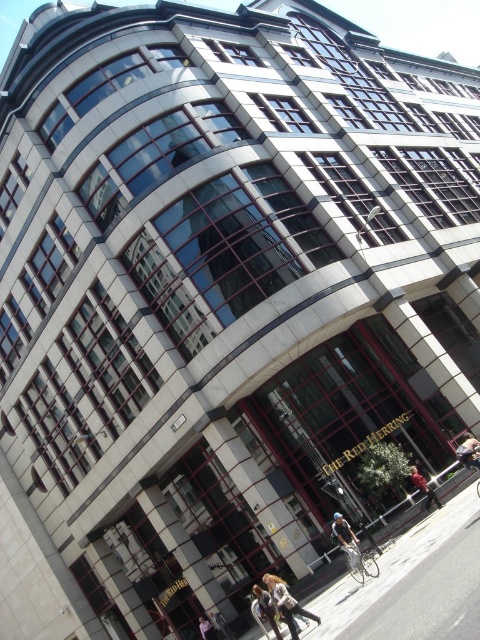
Which is more to the left, leather jacket at lower center or light brown leather jacket at lower center?

light brown leather jacket at lower center is more to the left.

Who is more distant from viewer, (264, 602) or (204, 621)?

Positioned behind is point (204, 621).

Find the location of a particular element. leather jacket at lower center is located at coordinates (264, 609).

Does brown leather jacket at center have a greater height compared to dark blue jeans at center?

Yes, brown leather jacket at center is taller than dark blue jeans at center.

Who is more forward, (x=274, y=586) or (x=421, y=474)?

Point (x=274, y=586) is more forward.

Find the location of a particular element. brown leather jacket at center is located at coordinates (283, 602).

Where is `leather jacket at center`? This screenshot has width=480, height=640. leather jacket at center is located at coordinates (468, 451).

Is point (458, 454) closer to viewer compared to point (204, 628)?

Yes, it is in front of point (204, 628).

Which is behind, point (462, 456) or point (202, 632)?

Positioned behind is point (202, 632).

This screenshot has height=640, width=480. Find the location of `leather jacket at center`. leather jacket at center is located at coordinates (468, 451).